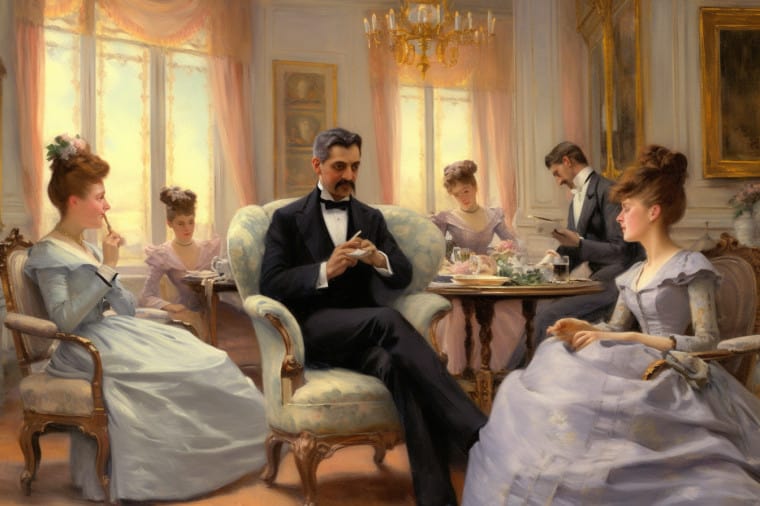
Find the location of a particular element. The height and width of the screenshot is (506, 760). hanging wall art is located at coordinates (306, 99), (726, 95).